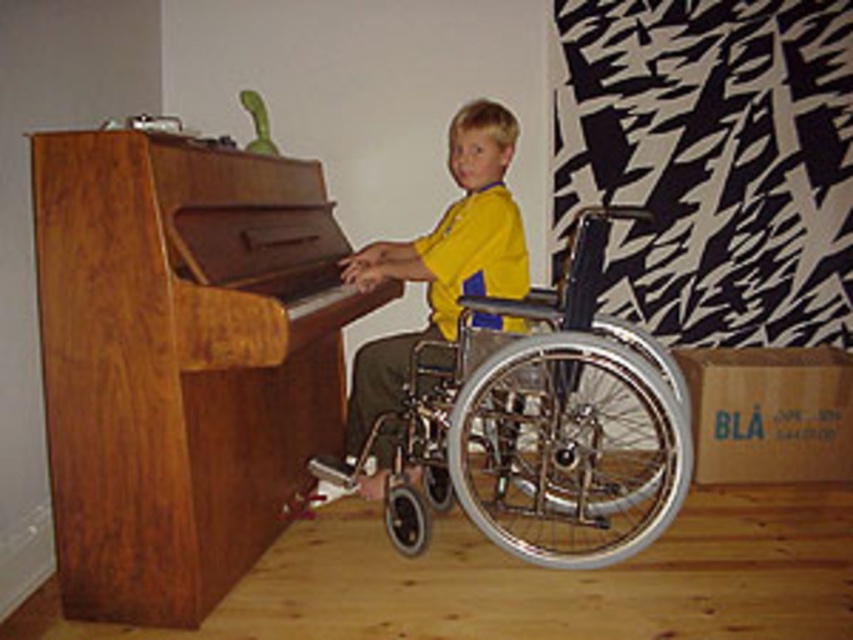
Question: Does wooden piano at left have a smaller size compared to silver metallic wheelchair at center?

Choices:
 (A) no
 (B) yes

Answer: (B)

Question: Can you confirm if wooden piano at left is positioned to the left of metallic silver wheelchair at center?

Choices:
 (A) no
 (B) yes

Answer: (B)

Question: Which point is farther from the camera taking this photo?

Choices:
 (A) (465, 445)
 (B) (123, 403)

Answer: (A)

Question: Based on their relative distances, which object is farther from the wooden piano at left?

Choices:
 (A) silver metallic wheelchair at center
 (B) metallic silver wheelchair at center

Answer: (A)

Question: Is wooden piano at left closer to the viewer compared to metallic silver wheelchair at center?

Choices:
 (A) no
 (B) yes

Answer: (B)

Question: Among these points, which one is farthest from the camera?

Choices:
 (A) (144, 397)
 (B) (358, 420)
 (C) (585, 452)

Answer: (B)